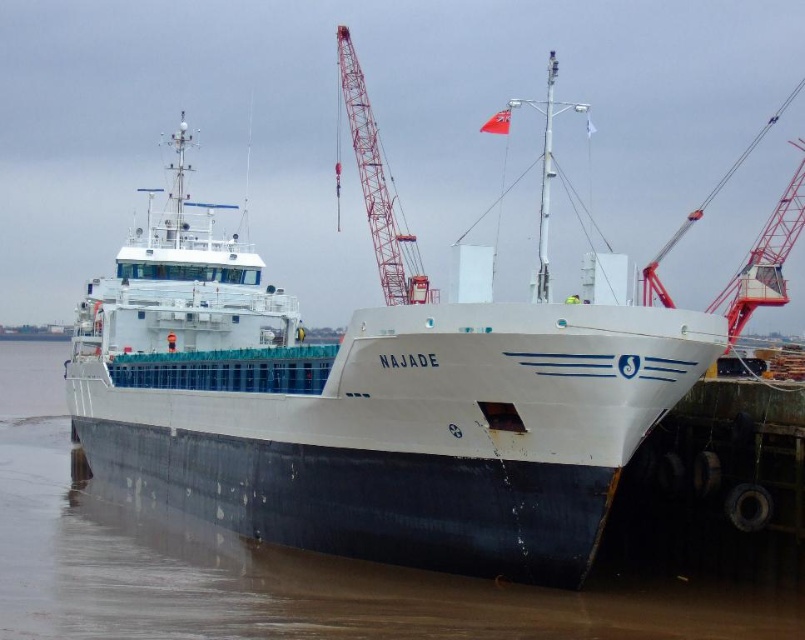
You are a dock worker observing the ship NAJADE. You notice the white matte water at center and the metallic red crane at upper right. Which object is located below the other?

The white matte water at center is positioned under the metallic red crane at upper right.

You are a crane operator tasked with lifting a container onto the white matte ship at center. The container is currently on the white matte water at center. Can you safely lift the container from the water and place it on the ship?

The white matte ship at center is much taller than the white matte water at center, so yes, the crane operator can safely lift the container from the white matte water at center and place it on the white matte ship at center since the ship is elevated higher than the water level.

You are an engineer inspecting the ship NAJADE. You need to move equipment from the red metallic crane at upper center to the metallic red crane at upper right. Which direction should you move the equipment?

The red metallic crane at upper center is to the left of the metallic red crane at upper right, so you should move the equipment to the right.